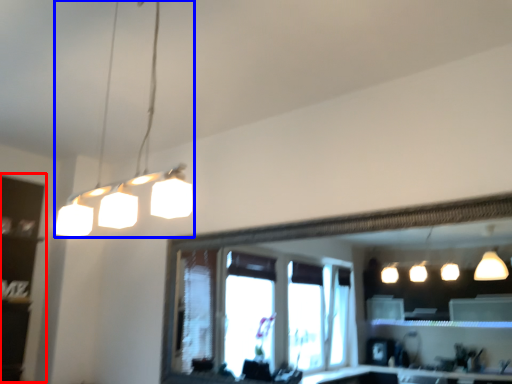
Question: Which point is further to the camera, shelf (highlighted by a red box) or lamp (highlighted by a blue box)?

Choices:
 (A) shelf
 (B) lamp

Answer: (A)